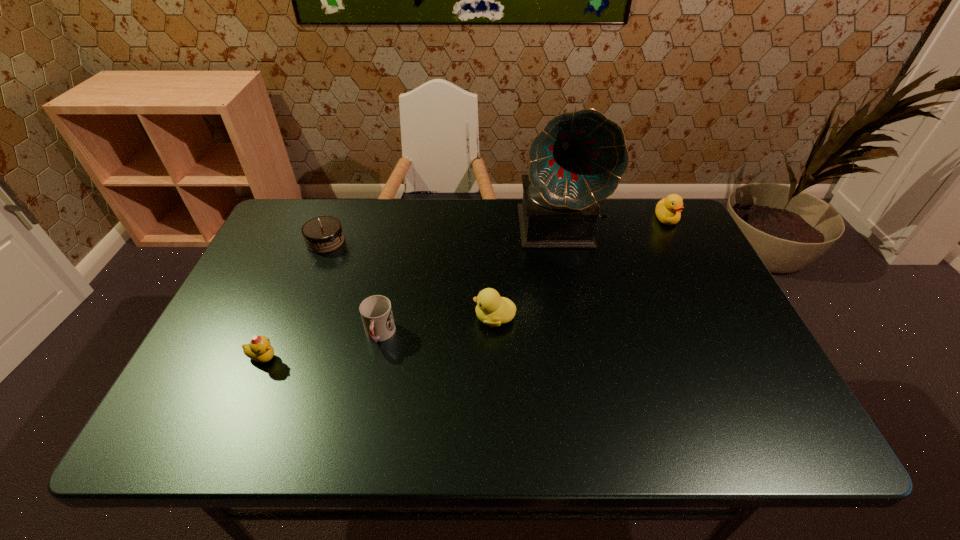
Where is `free area in between the fifth object from left to right and the chocolate cake`? The height and width of the screenshot is (540, 960). free area in between the fifth object from left to right and the chocolate cake is located at coordinates (443, 235).

You are a GUI agent. You are given a task and a screenshot of the screen. Output one action in this format:
    pyautogui.click(x=<x>, y=<y>)
    Task: Click on the vacant area that lies between the chocolate cake and the tallest object
    This screenshot has width=960, height=540.
    Given the screenshot: What is the action you would take?
    pyautogui.click(x=443, y=235)

Where is `free area in between the rightmost duckling and the second nearest duckling`? free area in between the rightmost duckling and the second nearest duckling is located at coordinates (580, 268).

Where is `free area in between the cup and the rightmost object`? Image resolution: width=960 pixels, height=540 pixels. free area in between the cup and the rightmost object is located at coordinates (523, 277).

Find the location of a particular element. This screenshot has height=540, width=960. vacant point located between the third object from right to left and the rightmost duckling is located at coordinates (580, 268).

This screenshot has width=960, height=540. Identify the location of empty location between the fifth object from left to right and the fourth object from right to left. (470, 281).

Find the location of a particular element. This screenshot has height=540, width=960. unoccupied area between the second nearest duckling and the chocolate cake is located at coordinates (410, 280).

In order to click on vacant space in between the cup and the rightmost duckling in this screenshot , I will do `click(523, 277)`.

This screenshot has width=960, height=540. In order to click on vacant space that's between the cup and the fifth object from left to right in this screenshot , I will do pos(470,281).

The width and height of the screenshot is (960, 540). I want to click on free space between the chocolate cake and the leftmost duckling, so click(295, 300).